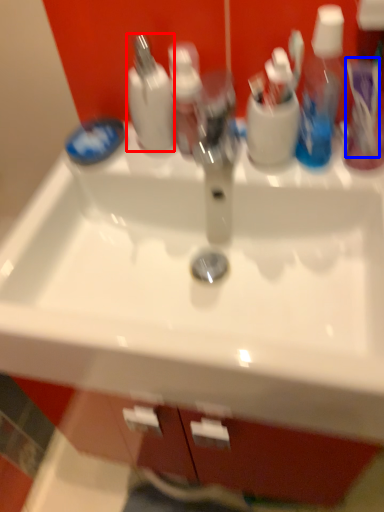
Question: Among these objects, which one is nearest to the camera, cleaning product (highlighted by a red box) or toothbrush (highlighted by a blue box)?

Choices:
 (A) cleaning product
 (B) toothbrush

Answer: (B)